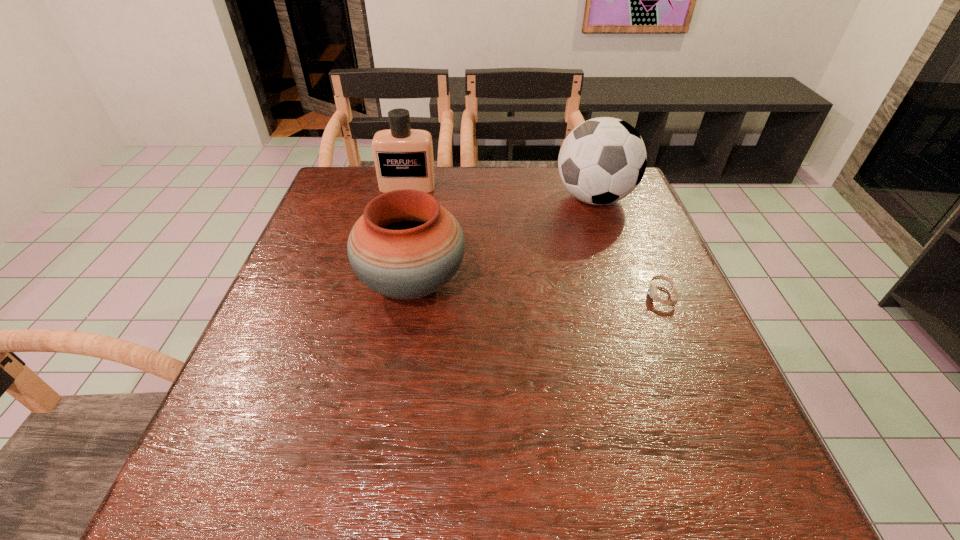
Identify the location of blank area at the near edge. (666, 501).

What are the coordinates of `free space at the left edge of the desktop` in the screenshot? It's located at point(338,242).

The width and height of the screenshot is (960, 540). In the image, there is a desktop. In order to click on free region at the right edge in this screenshot , I will do `click(679, 394)`.

This screenshot has width=960, height=540. I want to click on free region at the far left corner of the desktop, so click(x=337, y=189).

Find the location of `free location at the near left corner`. free location at the near left corner is located at coordinates (252, 485).

The width and height of the screenshot is (960, 540). Identify the location of unoccupied area between the watch and the pottery. (537, 289).

Locate an element on the screen. This screenshot has width=960, height=540. free space that is in between the soccer ball and the pottery is located at coordinates (503, 241).

In order to click on free point between the soccer ball and the perfume in this screenshot , I will do `click(501, 192)`.

Where is `vacant area between the soccer ball and the shortest object`? The width and height of the screenshot is (960, 540). vacant area between the soccer ball and the shortest object is located at coordinates (628, 247).

What are the coordinates of `free space that is in between the soccer ball and the perfume` in the screenshot? It's located at (501, 192).